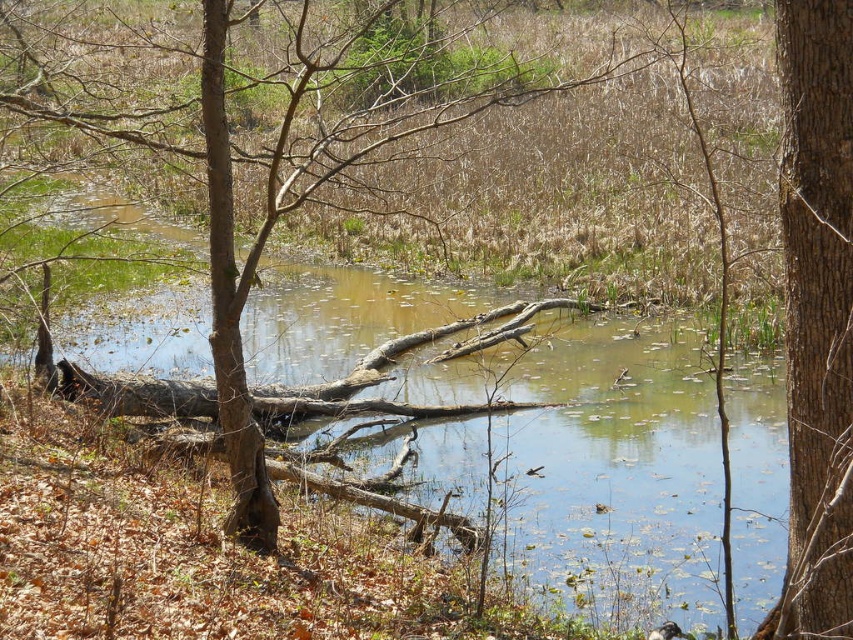
Does brown rough bark tree at right have a lesser height compared to brown rough bark tree trunk at left?

Yes.

Between brown rough bark tree at right and brown rough bark tree trunk at left, which one appears on the right side from the viewer's perspective?

From the viewer's perspective, brown rough bark tree at right appears more on the right side.

Measure the distance between point (x=788, y=138) and camera.

6.18 meters

Where is `brown rough bark tree at right`? The height and width of the screenshot is (640, 853). brown rough bark tree at right is located at coordinates (817, 312).

The width and height of the screenshot is (853, 640). What do you see at coordinates (598, 458) in the screenshot? I see `brown wood log at center` at bounding box center [598, 458].

Locate an element on the screen. This screenshot has width=853, height=640. brown wood log at center is located at coordinates (598, 458).

Who is positioned more to the right, brown wood log at center or brown rough bark tree at right?

brown rough bark tree at right

Between brown wood log at center and brown rough bark tree at right, which one has more height?

With more height is brown wood log at center.

I want to click on brown wood log at center, so click(598, 458).

The image size is (853, 640). What are the coordinates of `brown wood log at center` in the screenshot? It's located at (598, 458).